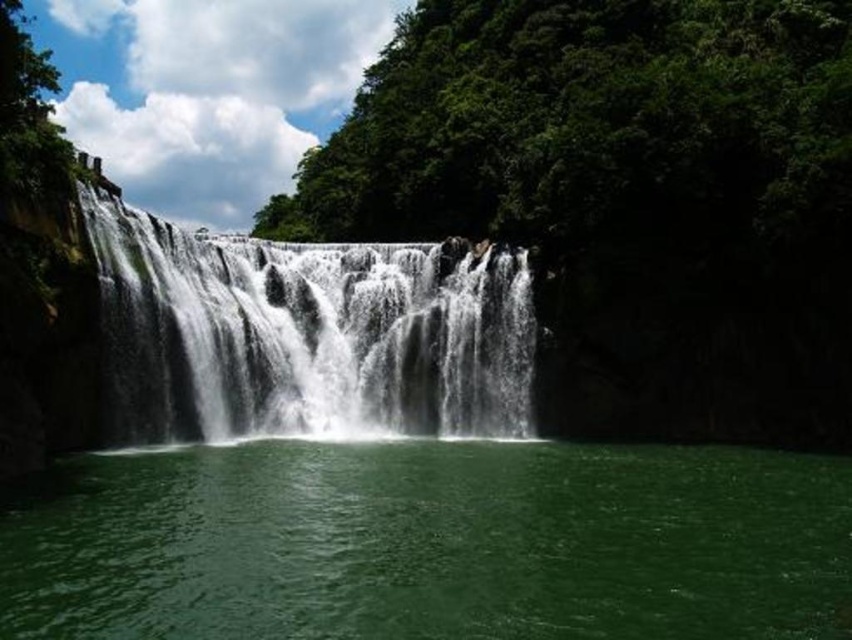
Can you confirm if green liquid at center is positioned to the left of white frothy water at center?

No, green liquid at center is not to the left of white frothy water at center.

Measure the distance between green liquid at center and camera.

A distance of 106.23 feet exists between green liquid at center and camera.

Is point (9, 536) positioned after point (308, 412)?

No, (9, 536) is in front of (308, 412).

The height and width of the screenshot is (640, 852). I want to click on green liquid at center, so click(x=435, y=545).